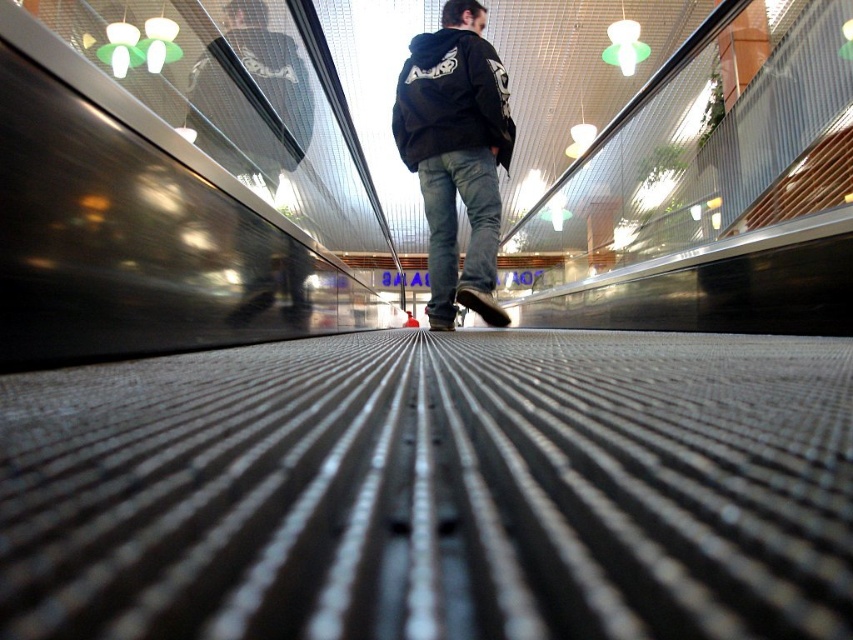
Does point (483, 104) come farther from viewer compared to point (486, 67)?

Yes, point (483, 104) is behind point (486, 67).

Is point (508, 164) closer to viewer compared to point (444, 92)?

No, it is behind (444, 92).

I want to click on black matte hoodie at center, so click(456, 154).

Does black cotton hoodie at center appear over denim at center?

Yes.

Between point (502, 125) and point (490, 288), which one is positioned in front?

Point (502, 125)

Is point (463, 108) farther from camera compared to point (485, 161)?

No, (463, 108) is closer to viewer.

Where is `black cotton hoodie at center`? This screenshot has height=640, width=853. black cotton hoodie at center is located at coordinates click(x=451, y=99).

Does black matte hoodie at center have a lesser width compared to denim at center?

No, black matte hoodie at center is not thinner than denim at center.

The image size is (853, 640). Describe the element at coordinates (456, 154) in the screenshot. I see `black matte hoodie at center` at that location.

Is point (457, 81) positioned after point (445, 230)?

No, (457, 81) is in front of (445, 230).

Identify the location of black matte hoodie at center. This screenshot has height=640, width=853. (456, 154).